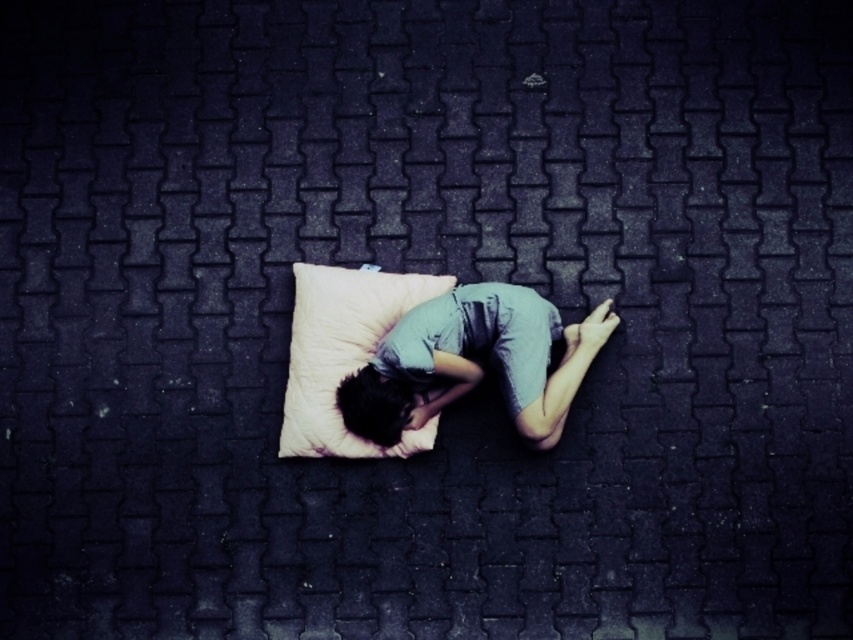
You are a delivery drone flying over a park and need to drop off a package to the light blue fabric person at center. According to the coordinates provided, where exactly should you aim your delivery?

The light blue fabric person at center is located at point (474, 362), so you should aim your delivery to that coordinate to reach them accurately.

You are a photographer trying to capture the light blue fabric person at center and the beige soft pillow at center in a single shot. Based on their positions, can you tell which object is closer to the camera?

The light blue fabric person at center is located below the beige soft pillow at center, so the beige soft pillow at center is closer to the camera.

You are a delivery robot that needs to place a small package between the light blue fabric person at center and the beige soft pillow at center. The package is 12 inches long. Can you fit it between them without moving either object?

The distance between the light blue fabric person at center and the beige soft pillow at center is 10.87 inches. Since the package is 12 inches long, it cannot fit between them without moving either object.